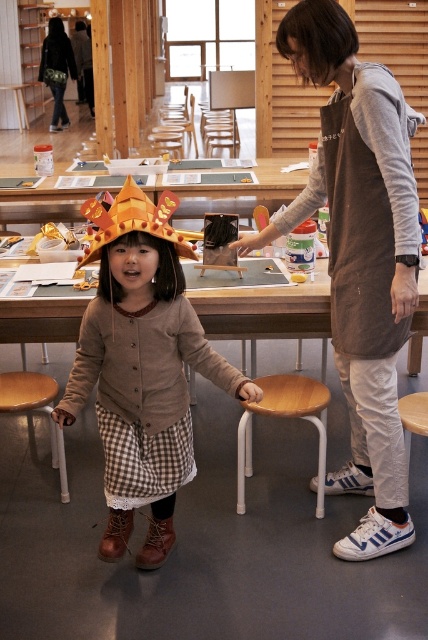
You are a visitor observing the scene. There is a gray cotton apron at center and a matte orange paper crown at center. Which object is taller?

The gray cotton apron at center is taller than the matte orange paper crown at center.

You are organizing a craft fair and have limited space on a display table. You need to place both the gray cotton apron at center and the matte orange paper crown at center side by side. Based on their sizes, which item should you place first to ensure they both fit?

Since the gray cotton apron at center is wider than the matte orange paper crown at center, you should place the wider gray cotton apron at center first to accommodate its larger size, then fit the smaller matte orange paper crown at center next to it.

You are standing in the workshop and need to place a new tool box between the wooden seat at center and the dark gray fabric bag at upper left. Based on their positions, which object should the tool box be closer to?

The wooden seat at center is to the right of the dark gray fabric bag at upper left, so the tool box should be placed closer to the dark gray fabric bag at upper left to maintain the leftward positioning.